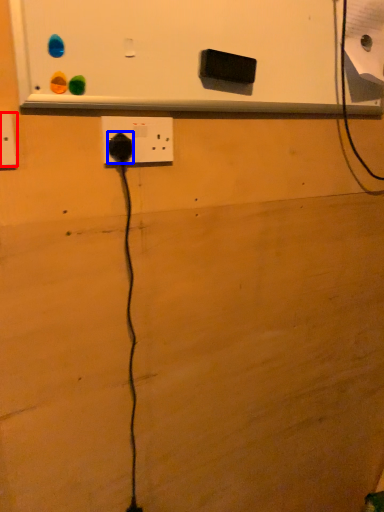
Question: Which object appears closest to the camera in this image, power plugs and sockets (highlighted by a red box) or power plugs and sockets (highlighted by a blue box)?

Choices:
 (A) power plugs and sockets
 (B) power plugs and sockets

Answer: (A)